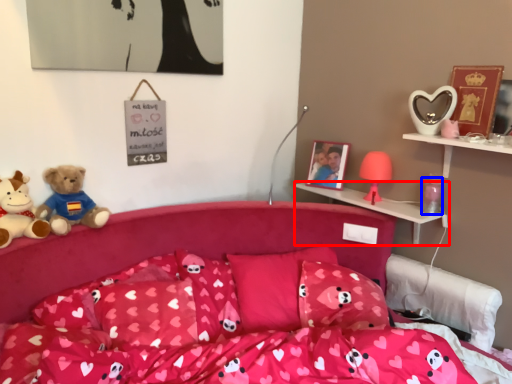
Question: Which object is closer to the camera taking this photo, shelf (highlighted by a red box) or toy (highlighted by a blue box)?

Choices:
 (A) shelf
 (B) toy

Answer: (A)